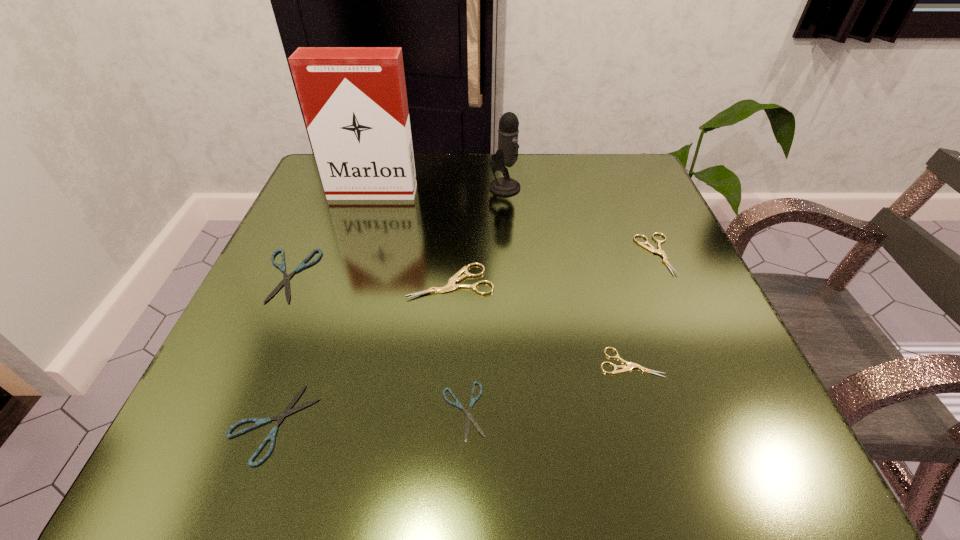
Where is `vacant area that lies between the seventh object from left to right and the farthest black shears`? This screenshot has width=960, height=540. vacant area that lies between the seventh object from left to right and the farthest black shears is located at coordinates (459, 319).

At what (x,y) coordinates should I click in order to perform the action: click on vacant region between the second biggest black shears and the fifth shortest shears. Please return your answer as a coordinate pair (x, y). Image resolution: width=960 pixels, height=540 pixels. Looking at the image, I should click on (465, 339).

You are a GUI agent. You are given a task and a screenshot of the screen. Output one action in this format:
    pyautogui.click(x=<x>, y=<y>)
    Task: Click on the object that is the fifth closest one to the microphone
    
    Given the screenshot: What is the action you would take?
    pyautogui.click(x=630, y=365)

Locate which object ranks in proximity to the farthest black shears. Please provide its 2D coordinates. Your answer should be formatted as a tuple, i.e. [(x, y)], where the tuple contains the x and y coordinates of a point satisfying the conditions above.

[(287, 411)]

Identify which shears is the sixth nearest to the cigarette_case. Please provide its 2D coordinates. Your answer should be formatted as a tuple, i.e. [(x, y)], where the tuple contains the x and y coordinates of a point satisfying the conditions above.

[(630, 365)]

Where is `shears that is the second closest one to the second biggest beige shears`? The image size is (960, 540). shears that is the second closest one to the second biggest beige shears is located at coordinates (x=450, y=286).

Point out which beige shears is positioned as the nearest to the black microphone. Please provide its 2D coordinates. Your answer should be formatted as a tuple, i.e. [(x, y)], where the tuple contains the x and y coordinates of a point satisfying the conditions above.

[(450, 286)]

Locate which beige shears is the closest to the cigarette_case. Please provide its 2D coordinates. Your answer should be formatted as a tuple, i.e. [(x, y)], where the tuple contains the x and y coordinates of a point satisfying the conditions above.

[(450, 286)]

This screenshot has width=960, height=540. I want to click on the third closest black shears to the tallest shears, so [x=287, y=411].

Image resolution: width=960 pixels, height=540 pixels. What are the coordinates of `black shears that stands as the closest to the tallest object` in the screenshot? It's located at (302, 265).